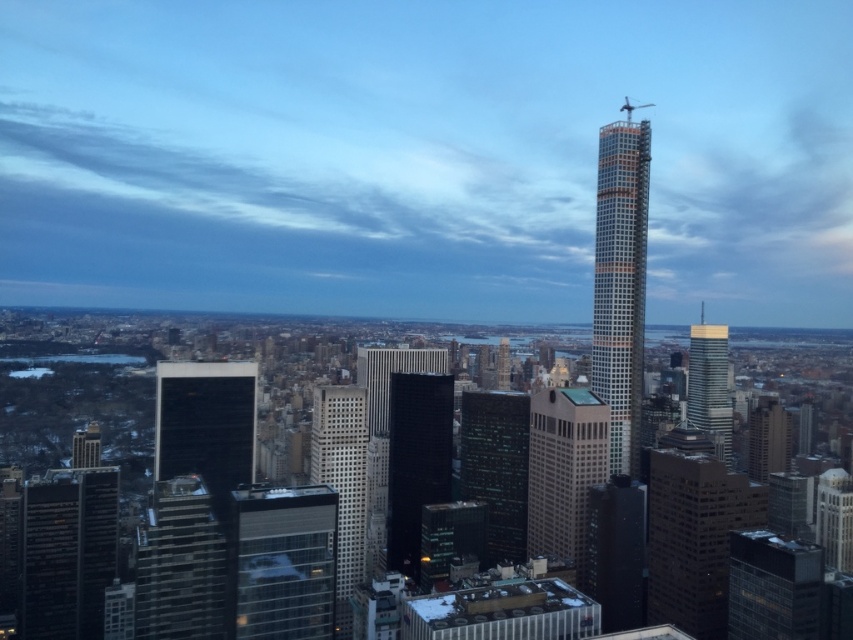
Question: Estimate the real-world distances between objects in this image. Which object is farther from the dark glass skyscraper at center?

Choices:
 (A) gold glass skyscraper at center-right
 (B) glassy reflective skyscraper at center

Answer: (A)

Question: Observing the image, what is the correct spatial positioning of dark glass skyscraper at center in reference to white glass skyscraper at center?

Choices:
 (A) left
 (B) right

Answer: (A)

Question: Is dark glass skyscraper at lower left below gold glass skyscraper at center-right?

Choices:
 (A) yes
 (B) no

Answer: (A)

Question: Among these points, which one is farthest from the camera?

Choices:
 (A) (38, 627)
 (B) (704, 348)
 (C) (352, 525)

Answer: (B)

Question: Can you confirm if dark glass skyscraper at center is wider than white glass skyscraper at center?

Choices:
 (A) yes
 (B) no

Answer: (A)

Question: Which is nearer to the black glass building at center?

Choices:
 (A) dark glass skyscraper at lower left
 (B) gold glass skyscraper at center-right
 (C) brown glass building at center
 (D) orange brick building at right

Answer: (C)